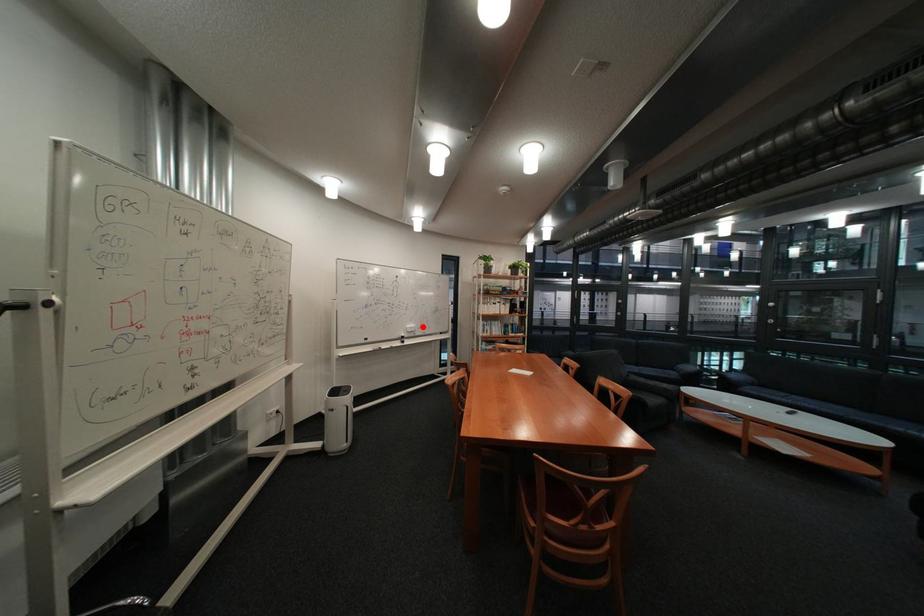
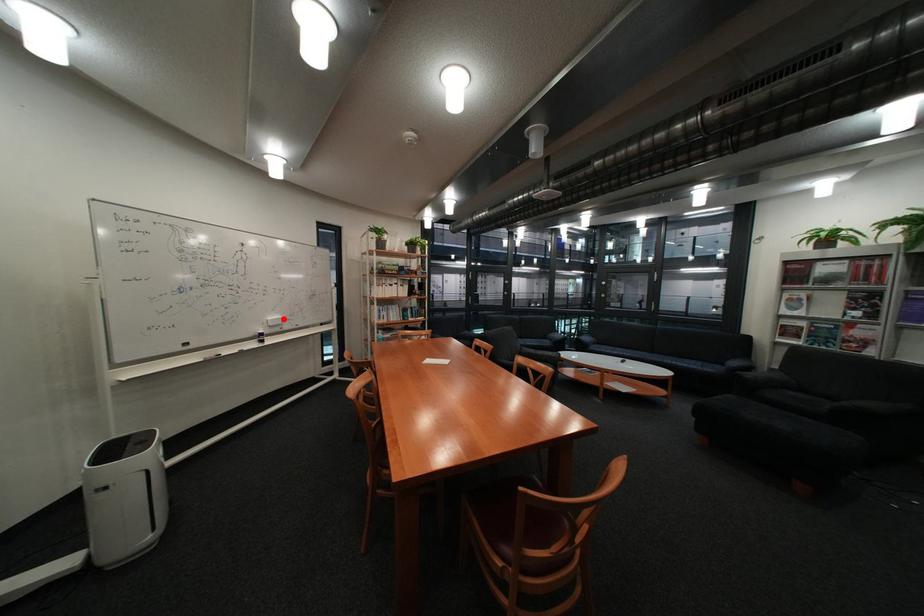
I am providing you with two images of the same scene from different viewpoints. A red point is marked on the first image and another point is marked on the second image. Does the point marked in image1 correspond to the same location as the one in image2?

Yes